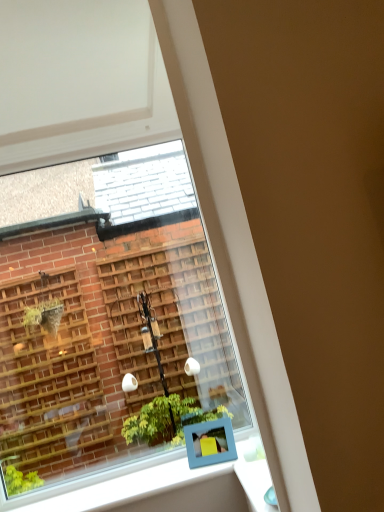
Question: Can you confirm if white glossy window sill at lower center is taller than clear glass window at upper left?

Choices:
 (A) yes
 (B) no

Answer: (B)

Question: Is white glossy window sill at lower center facing away from clear glass window at upper left?

Choices:
 (A) no
 (B) yes

Answer: (B)

Question: Considering the relative sizes of white glossy window sill at lower center and clear glass window at upper left in the image provided, is white glossy window sill at lower center thinner than clear glass window at upper left?

Choices:
 (A) yes
 (B) no

Answer: (B)

Question: From the image's perspective, is white glossy window sill at lower center below clear glass window at upper left?

Choices:
 (A) yes
 (B) no

Answer: (A)

Question: Would you consider white glossy window sill at lower center to be distant from clear glass window at upper left?

Choices:
 (A) yes
 (B) no

Answer: (A)

Question: Is the depth of white glossy window sill at lower center greater than that of clear glass window at upper left?

Choices:
 (A) yes
 (B) no

Answer: (B)

Question: Would you say clear glass window at upper left is a long distance from blue plastic frame at lower center?

Choices:
 (A) no
 (B) yes

Answer: (B)

Question: Considering the relative sizes of clear glass window at upper left and blue plastic frame at lower center in the image provided, is clear glass window at upper left taller than blue plastic frame at lower center?

Choices:
 (A) no
 (B) yes

Answer: (B)

Question: Considering the relative sizes of clear glass window at upper left and blue plastic frame at lower center in the image provided, is clear glass window at upper left thinner than blue plastic frame at lower center?

Choices:
 (A) no
 (B) yes

Answer: (B)

Question: Is clear glass window at upper left wider than blue plastic frame at lower center?

Choices:
 (A) no
 (B) yes

Answer: (A)

Question: From a real-world perspective, is clear glass window at upper left below blue plastic frame at lower center?

Choices:
 (A) no
 (B) yes

Answer: (A)

Question: Could blue plastic frame at lower center be considered to be inside clear glass window at upper left?

Choices:
 (A) no
 (B) yes

Answer: (A)

Question: From a real-world perspective, is white glossy window sill at lower center on blue plastic frame at lower center?

Choices:
 (A) no
 (B) yes

Answer: (A)